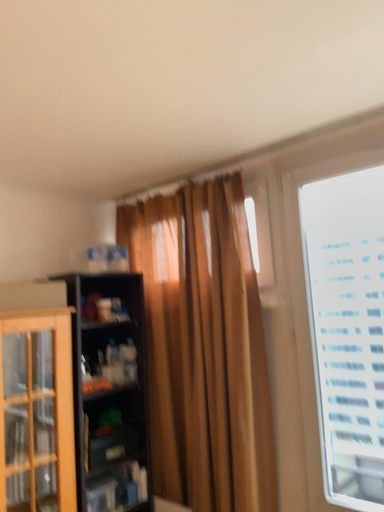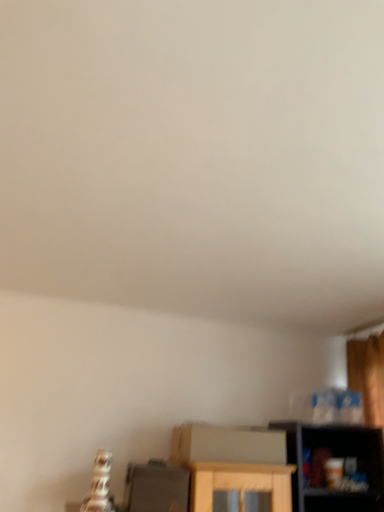
Question: How did the camera likely rotate when shooting the video?

Choices:
 (A) rotated downward
 (B) rotated upward

Answer: (B)